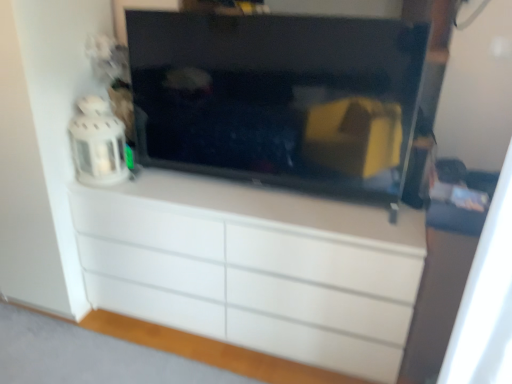
Find the location of a particular element. vacant space in front of black glossy tv at center is located at coordinates (265, 206).